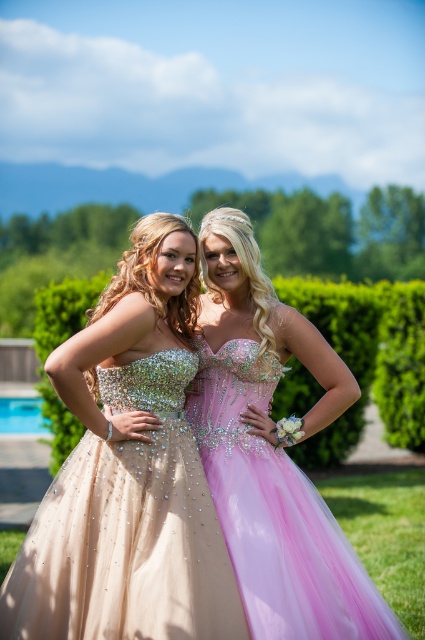
Question: Is sparkly beige dress at center below pink tulle dress at center?

Choices:
 (A) no
 (B) yes

Answer: (A)

Question: Does pink tulle dress at center have a greater width compared to green leafy hedge at center?

Choices:
 (A) yes
 (B) no

Answer: (B)

Question: Is sparkly beige dress at center to the right of green leafy hedge at center from the viewer's perspective?

Choices:
 (A) no
 (B) yes

Answer: (A)

Question: Which object appears farthest from the camera in this image?

Choices:
 (A) green leafy hedge at center
 (B) sparkly beige dress at center
 (C) pink tulle dress at center

Answer: (A)

Question: Which of the following is the closest to the observer?

Choices:
 (A) green leafy hedge at center
 (B) pink tulle dress at center

Answer: (B)

Question: Which of these objects is positioned closest to the green leafy hedge at center?

Choices:
 (A) sparkly beige dress at center
 (B) blue glass pool at lower left

Answer: (A)